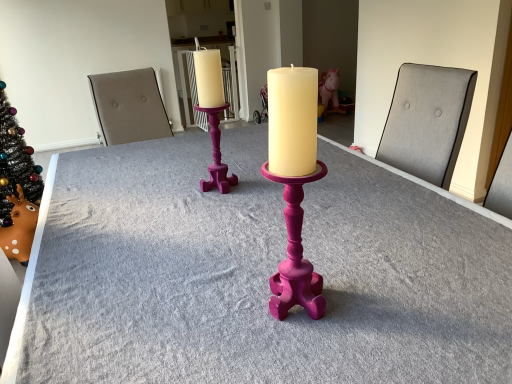
This screenshot has width=512, height=384. What do you see at coordinates (255, 275) in the screenshot?
I see `matte pink candlestick at center` at bounding box center [255, 275].

Locate an element on the screen. The width and height of the screenshot is (512, 384). matte pink candlestick at center is located at coordinates (255, 275).

Image resolution: width=512 pixels, height=384 pixels. I want to click on matte pink candlestick at center, so click(x=255, y=275).